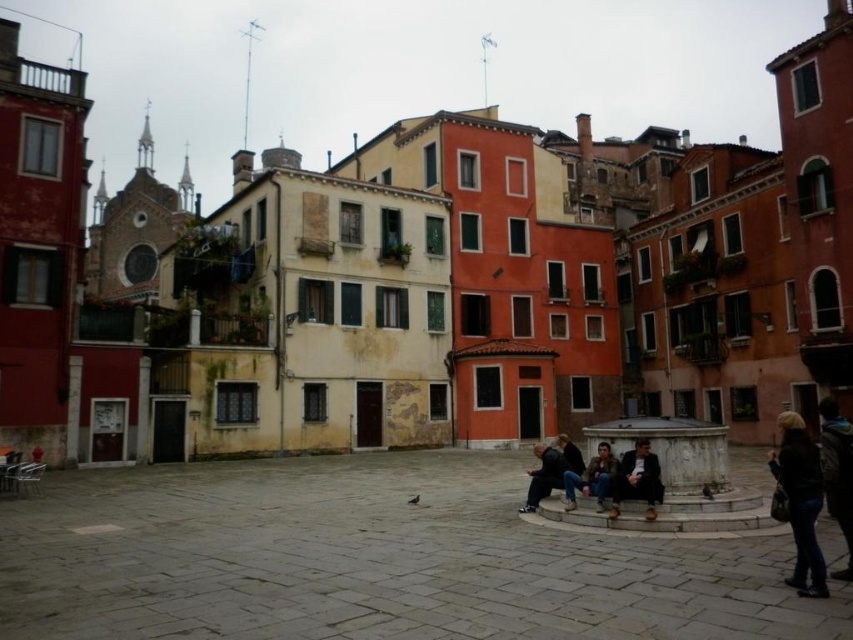
Does dark brown leather jacket at lower right appear over dark brown leather jacket at center?

Incorrect, dark brown leather jacket at lower right is not positioned above dark brown leather jacket at center.

From the picture: Which of these two, dark brown leather jacket at lower right or dark brown leather jacket at center, stands shorter?

Standing shorter between the two is dark brown leather jacket at center.

The width and height of the screenshot is (853, 640). What do you see at coordinates (799, 500) in the screenshot?
I see `dark brown leather jacket at lower right` at bounding box center [799, 500].

What are the coordinates of `dark brown leather jacket at lower right` in the screenshot? It's located at (799, 500).

Measure the distance between point (575,480) and camera.

They are 37.87 meters apart.

Can you confirm if leather jacket at center is positioned below matte black jacket at lower center?

Actually, leather jacket at center is above matte black jacket at lower center.

Which is behind, point (573, 488) or point (537, 486)?

The point (537, 486) is behind.

Where is `leather jacket at center`? The image size is (853, 640). leather jacket at center is located at coordinates (590, 477).

Does dark brown leather jacket at center have a smaller size compared to matte black jacket at lower center?

Yes.

The width and height of the screenshot is (853, 640). What do you see at coordinates (637, 480) in the screenshot? I see `dark brown leather jacket at center` at bounding box center [637, 480].

This screenshot has height=640, width=853. I want to click on dark brown leather jacket at center, so click(637, 480).